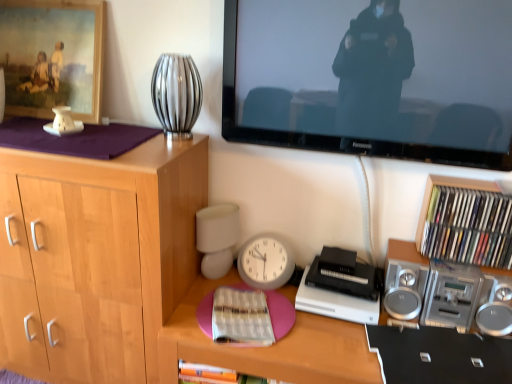
The image size is (512, 384). I want to click on light wood cabinet at left, so click(96, 258).

This screenshot has width=512, height=384. What do you see at coordinates (270, 346) in the screenshot? I see `pink matte desk at center` at bounding box center [270, 346].

What do you see at coordinates (241, 318) in the screenshot?
I see `white paper book at center, the second book in the top-to-bottom sequence` at bounding box center [241, 318].

What do you see at coordinates (52, 56) in the screenshot? I see `wooden framed painting at upper left` at bounding box center [52, 56].

Measure the distance between silver metallic vase at upper center and camera.

Answer: A distance of 1.48 meters exists between silver metallic vase at upper center and camera.

Identify the location of black plastic printer at center. (340, 287).

Between wooden framed painting at upper left and pink matte desk at center, which one has smaller width?

wooden framed painting at upper left.

Is the depth of wooden framed painting at upper left less than that of pink matte desk at center?

That is False.

Between wooden framed painting at upper left and pink matte desk at center, which one has larger size?

With larger size is pink matte desk at center.

Is silver metallic stereo at right oriented towards light wood cabinet at left?

No, silver metallic stereo at right is not turned towards light wood cabinet at left.

What's the angular difference between silver metallic stereo at right and light wood cabinet at left's facing directions?

0.231 degrees.

Are silver metallic stereo at right and light wood cabinet at left making contact?

No, silver metallic stereo at right is not next to light wood cabinet at left.

From a real-world perspective, between black plastic printer at center and wooden framed painting at upper left, who is vertically lower?

black plastic printer at center is physically lower.

Does black plastic printer at center have a smaller size compared to wooden framed painting at upper left?

Correct, black plastic printer at center occupies less space than wooden framed painting at upper left.

Locate an element on the screen. equipment that appears in front of the wooden framed painting at upper left is located at coordinates [x=340, y=287].

Looking at this image, between pink matte desk at center and wooden framed painting at upper left, which one has less height?

pink matte desk at center.

Is pink matte desk at center facing away from wooden framed painting at upper left?

pink matte desk at center is not turned away from wooden framed painting at upper left.

Who is bigger, pink matte desk at center or wooden framed painting at upper left?

With larger size is pink matte desk at center.

The width and height of the screenshot is (512, 384). In the image, there is a pink matte desk at center. Identify the location of picture frame above it (from the image's perspective). [52, 56].

From the image's perspective, is pink matte desk at center over multicolored paper book at right, which is the 1th book in right-to-left order?

No, from the image's perspective, pink matte desk at center is not above multicolored paper book at right, which is the 1th book in right-to-left order.

From a real-world perspective, does pink matte desk at center stand above multicolored paper book at right, positioned as the first book in top-to-bottom order?

No, from a real-world perspective, pink matte desk at center is not over multicolored paper book at right, positioned as the first book in top-to-bottom order

Which object is positioned more to the right, pink matte desk at center or multicolored paper book at right, which is the 1th book in right-to-left order?

Positioned to the right is multicolored paper book at right, which is the 1th book in right-to-left order.

Is pink matte desk at center aimed at multicolored paper book at right, arranged as the 2th book when ordered from the bottom?

No.

Is black plastic printer at center in front of or behind light wood cabinet at left in the image?

Visually, black plastic printer at center is located behind light wood cabinet at left.

From the image's perspective, is black plastic printer at center beneath light wood cabinet at left?

Indeed, from the image's perspective, black plastic printer at center is shown beneath light wood cabinet at left.

Considering the relative positions of black plastic printer at center and light wood cabinet at left in the image provided, is black plastic printer at center to the left of light wood cabinet at left from the viewer's perspective?

No.

Measure the distance between black plastic printer at center and light wood cabinet at left.

A distance of 28.32 inches exists between black plastic printer at center and light wood cabinet at left.

Relative to wooden framed painting at upper left, is silver metallic stereo at right in front or behind?

Visually, silver metallic stereo at right is located in front of wooden framed painting at upper left.

Considering the relative sizes of silver metallic stereo at right and wooden framed painting at upper left in the image provided, is silver metallic stereo at right smaller than wooden framed painting at upper left?

No.

From a real-world perspective, is silver metallic stereo at right above or below wooden framed painting at upper left?

silver metallic stereo at right is situated lower than wooden framed painting at upper left in the real world.

The height and width of the screenshot is (384, 512). In order to click on picture frame lying on the left of pink matte desk at center in this screenshot , I will do `click(52, 56)`.

This screenshot has width=512, height=384. In order to click on stereo above the light wood cabinet at left (from a real-world perspective) in this screenshot , I will do `click(442, 292)`.

From the image, which object appears to be nearer to pink matte desk at center, light wood cabinet at left or multicolored paper book at right, which is the 1th book in right-to-left order?

light wood cabinet at left lies closer to pink matte desk at center than the other object.

Based on their spatial positions, is pink matte desk at center or silver metallic stereo at right further from light wood cabinet at left?

silver metallic stereo at right lies further to light wood cabinet at left than the other object.

Estimate the real-world distances between objects in this image. Which object is further from light wood cabinet at left, multicolored paper book at right, which is the 1th book in right-to-left order, or white paper book at center, which is the first book from left to right?

The object further to light wood cabinet at left is multicolored paper book at right, which is the 1th book in right-to-left order.

Based on their spatial positions, is silver metallic vase at upper center or black plastic printer at center further from pink matte desk at center?

silver metallic vase at upper center.

In the scene shown: From the image, which object appears to be nearer to pink matte desk at center, black plastic printer at center or light wood cabinet at left?

black plastic printer at center.

Looking at the image, which one is located further to silver metallic stereo at right, pink matte desk at center or white paper book at center, which is the first book from left to right?

white paper book at center, which is the first book from left to right, is further to silver metallic stereo at right.

Based on their spatial positions, is silver metallic vase at upper center or silver metallic stereo at right further from white paper book at center, acting as the 1th book starting from the bottom?

Based on the image, silver metallic vase at upper center appears to be further to white paper book at center, acting as the 1th book starting from the bottom.

Looking at the image, which one is located closer to white paper book at center, the second book in the top-to-bottom sequence, silver metallic stereo at right or multicolored paper book at right, positioned as the first book in top-to-bottom order?

silver metallic stereo at right.

The width and height of the screenshot is (512, 384). Identify the location of table lamp between wooden framed painting at upper left and light wood cabinet at left from top to bottom. (176, 94).

The height and width of the screenshot is (384, 512). I want to click on book situated between light wood cabinet at left and silver metallic stereo at right from left to right, so click(x=241, y=318).

At what (x,y) coordinates should I click in order to perform the action: click on equipment between white paper book at center, placed as the second book when sorted from right to left, and multicolored paper book at right, which is the 2th book from left to right. Please return your answer as a coordinate pair (x, y). The width and height of the screenshot is (512, 384). Looking at the image, I should click on (340, 287).

Where is `cabinetry situated between wooden framed painting at upper left and multicolored paper book at right, positioned as the first book in top-to-bottom order, from left to right`? Image resolution: width=512 pixels, height=384 pixels. cabinetry situated between wooden framed painting at upper left and multicolored paper book at right, positioned as the first book in top-to-bottom order, from left to right is located at coordinates (96, 258).